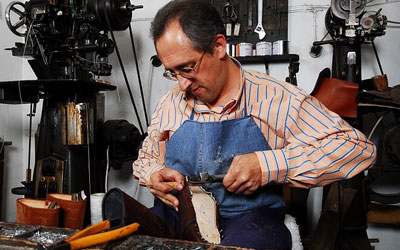
The image size is (400, 250). I want to click on wall, so pyautogui.click(x=306, y=69).